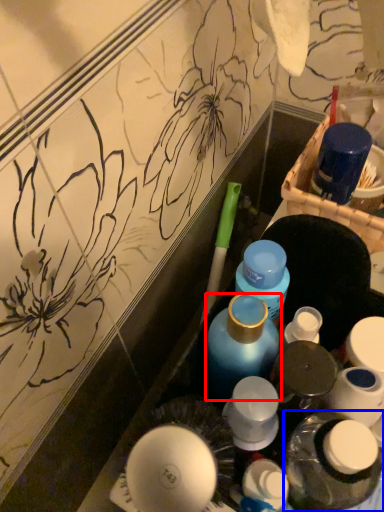
Question: Which object appears closest to the camera in this image, bottle (highlighted by a red box) or bottle (highlighted by a blue box)?

Choices:
 (A) bottle
 (B) bottle

Answer: (B)